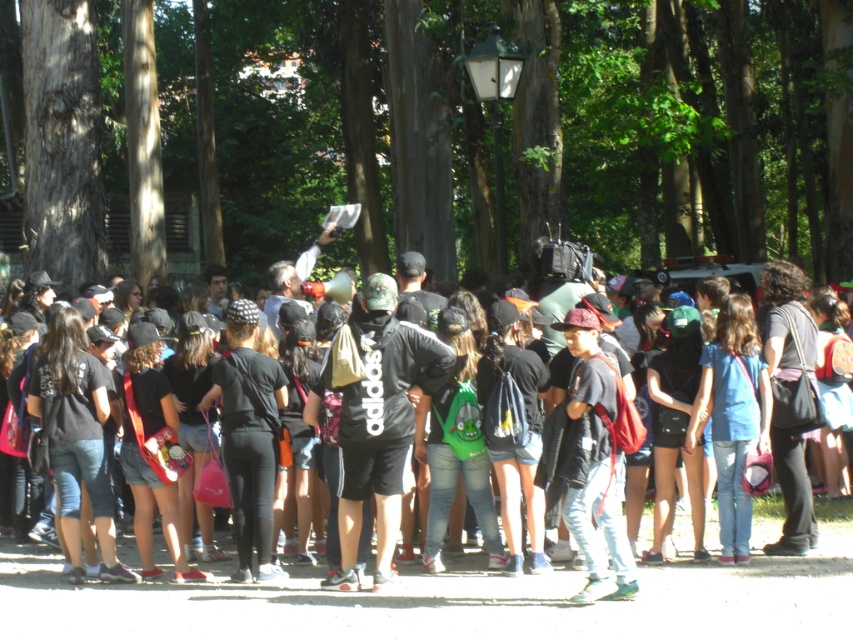
Can you confirm if brown textured tree at upper center is positioned below smooth brown tree trunk at left?

No, brown textured tree at upper center is not below smooth brown tree trunk at left.

Who is more forward, (207, 224) or (47, 230)?

Positioned in front is point (47, 230).

Locate an element on the screen. brown textured tree at upper center is located at coordinates (434, 129).

Between smooth brown tree trunk at left and black matte shirt at center, which one is positioned lower?

black matte shirt at center

Does smooth brown tree trunk at left come in front of black matte shirt at center?

No, smooth brown tree trunk at left is behind black matte shirt at center.

Locate an element on the screen. The height and width of the screenshot is (640, 853). smooth brown tree trunk at left is located at coordinates (61, 141).

Is brown textured tree at upper center wider than black matte shirt at center?

Yes, brown textured tree at upper center is wider than black matte shirt at center.

Based on the photo, between brown textured tree at upper center and black matte shirt at center, which one has less height?

Result: black matte shirt at center is shorter.

Is point (245, 22) farther from viewer compared to point (273, 596)?

Yes, it is.

Image resolution: width=853 pixels, height=640 pixels. Identify the location of brown textured tree at upper center. (434, 129).